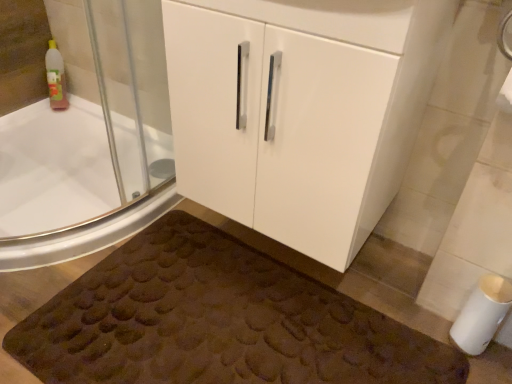
Question: Is white matte toilet paper at lower right aimed at white glossy cabinet at center?

Choices:
 (A) yes
 (B) no

Answer: (B)

Question: Does white matte toilet paper at lower right come behind white glossy cabinet at center?

Choices:
 (A) no
 (B) yes

Answer: (B)

Question: From the image's perspective, is white matte toilet paper at lower right under white glossy cabinet at center?

Choices:
 (A) yes
 (B) no

Answer: (A)

Question: Considering the relative sizes of white matte toilet paper at lower right and white glossy cabinet at center in the image provided, is white matte toilet paper at lower right smaller than white glossy cabinet at center?

Choices:
 (A) no
 (B) yes

Answer: (B)

Question: Can you confirm if white matte toilet paper at lower right is shorter than white glossy cabinet at center?

Choices:
 (A) no
 (B) yes

Answer: (B)

Question: Does point (501, 279) appear closer or farther from the camera than point (366, 215)?

Choices:
 (A) closer
 (B) farther

Answer: (A)

Question: Visually, is white matte toilet paper at lower right positioned to the left or to the right of white glossy cabinet at center?

Choices:
 (A) right
 (B) left

Answer: (A)

Question: Is white matte toilet paper at lower right spatially inside white glossy cabinet at center, or outside of it?

Choices:
 (A) outside
 (B) inside

Answer: (A)

Question: In terms of size, does white matte toilet paper at lower right appear bigger or smaller than white glossy cabinet at center?

Choices:
 (A) big
 (B) small

Answer: (B)

Question: Considering the positions of point (92, 321) and point (269, 165), is point (92, 321) closer or farther from the camera than point (269, 165)?

Choices:
 (A) closer
 (B) farther

Answer: (B)

Question: Is brown textured bath mat at lower center spatially inside white glossy cabinet at center, or outside of it?

Choices:
 (A) inside
 (B) outside

Answer: (B)

Question: Based on their sizes in the image, would you say brown textured bath mat at lower center is bigger or smaller than white glossy cabinet at center?

Choices:
 (A) big
 (B) small

Answer: (B)

Question: Is brown textured bath mat at lower center in front of or behind white glossy cabinet at center in the image?

Choices:
 (A) behind
 (B) front

Answer: (A)

Question: Based on their positions, is white matte toilet paper at lower right located to the left or right of white glossy bathtub at upper left?

Choices:
 (A) left
 (B) right

Answer: (B)

Question: From a real-world perspective, is white matte toilet paper at lower right physically located above or below white glossy bathtub at upper left?

Choices:
 (A) below
 (B) above

Answer: (A)